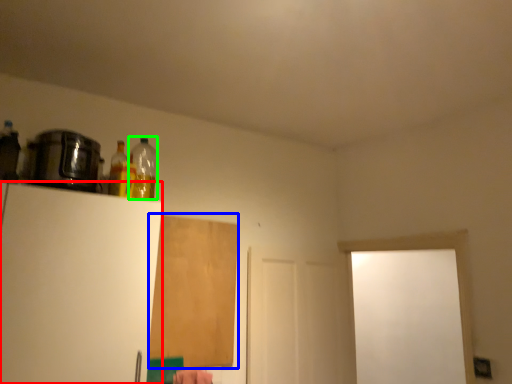
Question: Which object is positioned closest to appliance (highlighted by a red box)? Select from plywood (highlighted by a blue box) and bottle (highlighted by a green box).

Choices:
 (A) plywood
 (B) bottle

Answer: (B)